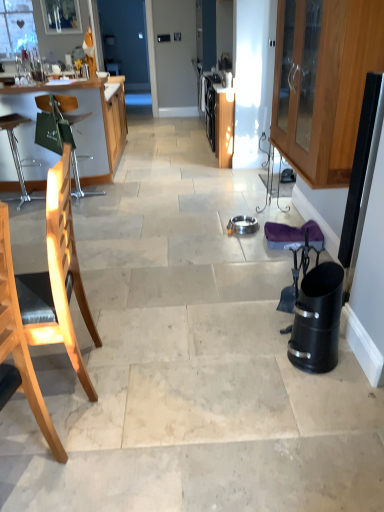
Identify the location of unoccupied area in front of black plastic trash can at right. Image resolution: width=384 pixels, height=512 pixels. (319, 389).